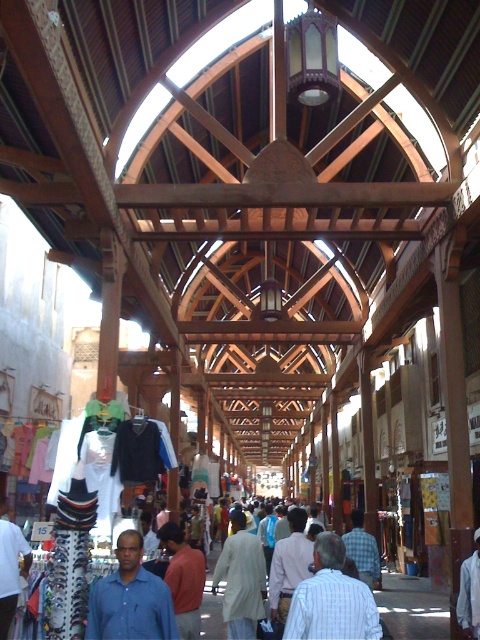
Question: Based on their relative distances, which object is nearer to the light beige fabric at center?

Choices:
 (A) plaid shirt at center
 (B) red shirt at center
 (C) light blue shirt at center
 (D) blue shirt at center

Answer: (B)

Question: Which point appears closest to the camera in this image?

Choices:
 (A) (232, 588)
 (B) (201, 554)

Answer: (B)

Question: Can you confirm if light beige fabric at center is wider than plaid shirt at center?

Choices:
 (A) yes
 (B) no

Answer: (A)

Question: Can you confirm if white fabric shirt at center is positioned below plaid shirt at center?

Choices:
 (A) yes
 (B) no

Answer: (B)

Question: Does red shirt at center appear on the left side of plaid shirt at center?

Choices:
 (A) yes
 (B) no

Answer: (A)

Question: Among these points, which one is nearest to the camera?

Choices:
 (A) (342, 556)
 (B) (235, 566)
 (C) (167, 531)

Answer: (A)